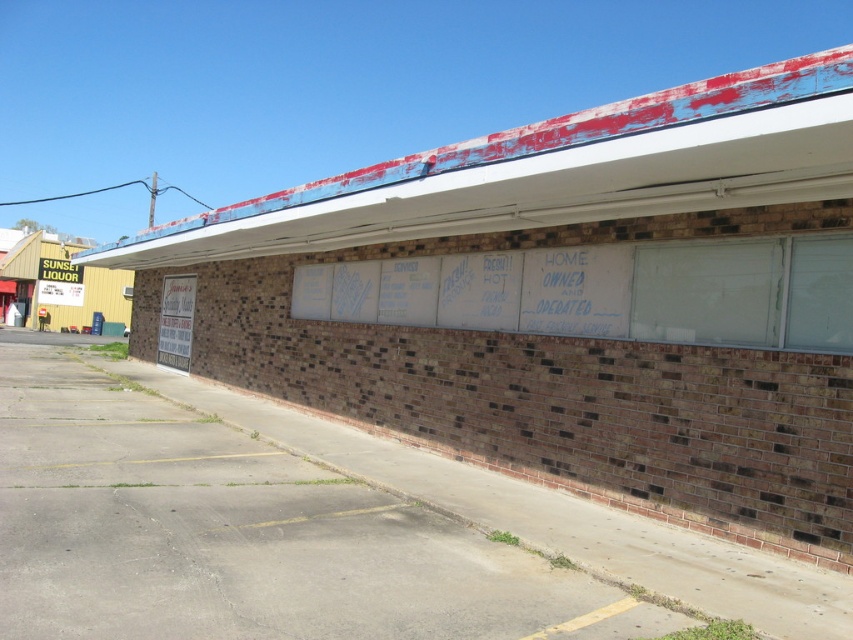
You are standing in front of the building and want to read both the white chalkboard at center and the white paperboard at center. Which one do you see first?

The white chalkboard at center is closer to the viewer than the white paperboard at center, so you will see the white chalkboard at center first.

Based on the photo, you are a customer looking at the building and want to read both the white chalkboard at center and the white paperboard at center. Which one is on the right side from your perspective?

The white chalkboard at center is positioned on the right side of the white paperboard at center, so from your perspective, the white chalkboard at center is on the right side.

You are a delivery person trying to write a note on the white chalkboard at center and the white paperboard at center. Which surface will allow you to write a wider message without needing to turn the board? Please explain your reasoning based on their sizes.

The white paperboard at center has a greater width than the white chalkboard at center, so it can accommodate a wider message without needing to turn the board.